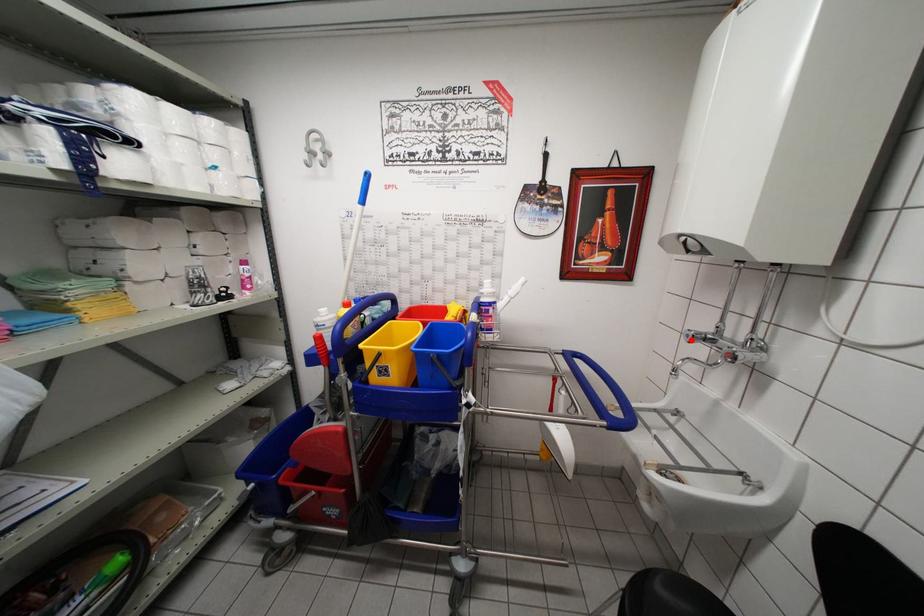
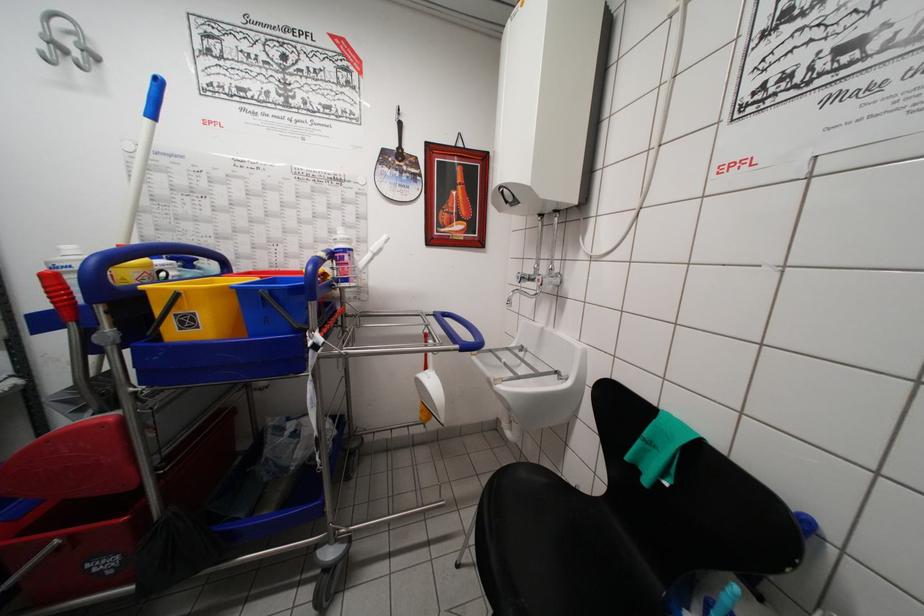
Find the pixel in the second image that matches the highlighted location in the first image.

(521, 282)